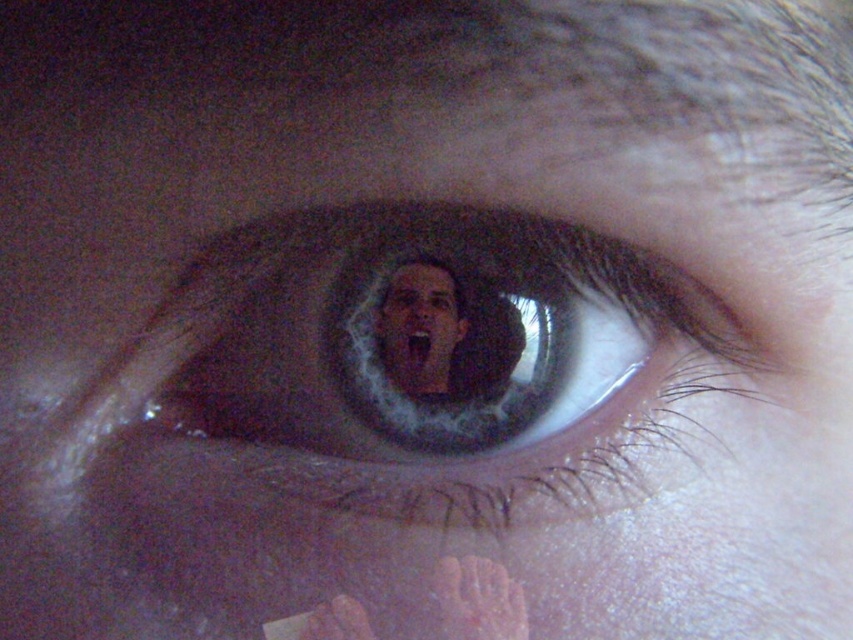
You are a photographer trying to capture the reflection in the brown matte eye at center. You notice a point marked at coordinates (430, 364). Where exactly is this point located in relation to the brown matte eye at center?

The point (430, 364) is on the brown matte eye at center.

You are a photographer trying to capture a reflection in the brown matte eye at center and the smooth skin face at center. Which object is located to the right side of the other?

The brown matte eye at center is positioned on the right side of smooth skin face at center, so the eye is to the right of the face.

You are a photographer adjusting your camera settings to capture a detailed closeup of the brown matte eye at center and the smooth skin face at center. Based on their positions, which object should you focus on first to ensure both are in sharp focus?

The brown matte eye at center is in front of the smooth skin face at center, so you should focus on the brown matte eye at center first to ensure both are in sharp focus.